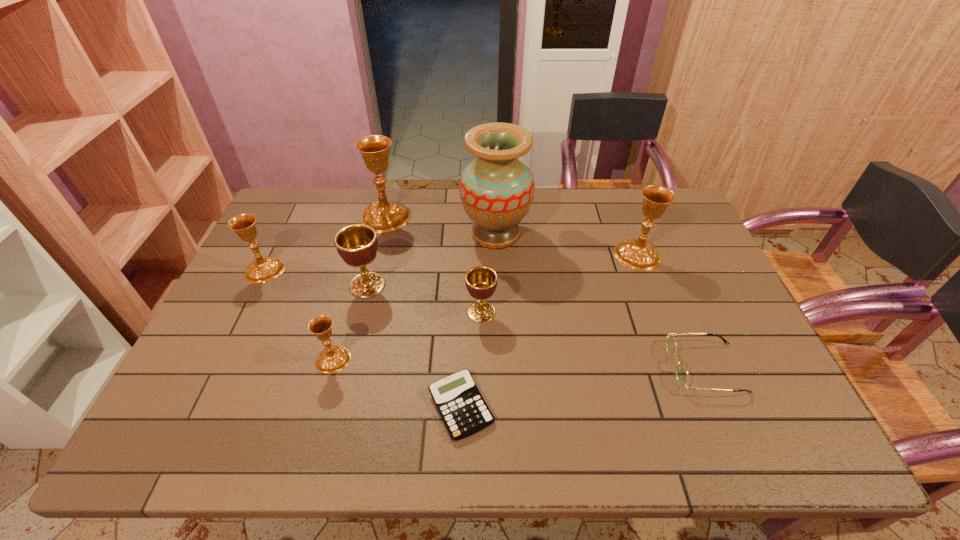
The height and width of the screenshot is (540, 960). I want to click on free space located on the right of the farther golden chalice, so click(498, 285).

The height and width of the screenshot is (540, 960). Identify the location of free location located on the back of the second chalice from right to left. (481, 248).

Identify the location of blank area located on the left of the nearest chalice. coord(206,359).

The width and height of the screenshot is (960, 540). I want to click on free space located 0.220m on the lenses of the second shortest object, so click(580, 368).

I want to click on vacant space located on the lenses of the second shortest object, so click(x=588, y=368).

This screenshot has width=960, height=540. In order to click on free space located 0.130m on the lenses of the second shortest object in this screenshot , I will do `click(617, 368)`.

Identify the location of vacant region located 0.320m on the back of the calculator. Image resolution: width=960 pixels, height=540 pixels. (466, 280).

You are a GUI agent. You are given a task and a screenshot of the screen. Output one action in this format:
    pyautogui.click(x=<x>, y=<y>)
    Task: Click on the vase situated at the far edge
    
    Given the screenshot: What is the action you would take?
    pyautogui.click(x=497, y=189)

Where is `chalice located in the far edge section of the desktop`? The image size is (960, 540). chalice located in the far edge section of the desktop is located at coordinates (384, 216).

Locate an element on the screen. The width and height of the screenshot is (960, 540). object positioned at the near edge is located at coordinates (460, 404).